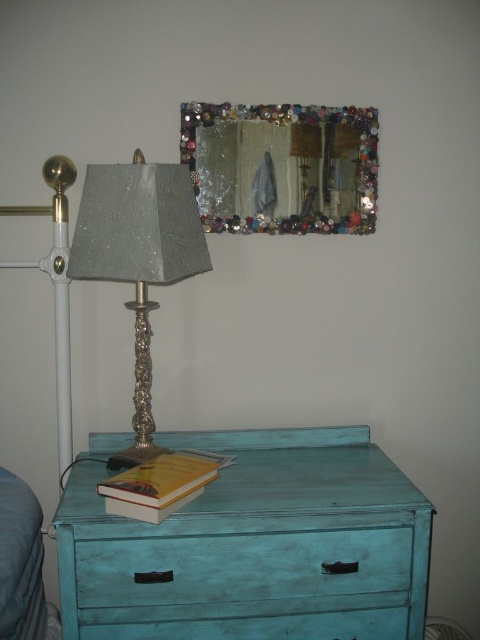
Question: Which object appears closest to the camera in this image?

Choices:
 (A) turquoise distressed wood table at lower center
 (B) yellow paperback book at lower center

Answer: (B)

Question: Is the position of decorative glass mirror at upper center more distant than that of shiny silver lamp at left?

Choices:
 (A) no
 (B) yes

Answer: (B)

Question: Which object is positioned closest to the decorative glass mirror at upper center?

Choices:
 (A) turquoise distressed wood table at lower center
 (B) shiny silver lamp at left
 (C) teal painted wood drawer at center
 (D) yellow paperback book at lower center

Answer: (B)

Question: Does decorative glass mirror at upper center appear on the right side of yellow paperback book at lower center?

Choices:
 (A) no
 (B) yes

Answer: (B)

Question: Which object is positioned farthest from the teal painted wood drawer at center?

Choices:
 (A) shiny silver lamp at left
 (B) decorative glass mirror at upper center
 (C) yellow paperback book at lower center
 (D) turquoise distressed wood table at lower center

Answer: (B)

Question: Can you confirm if decorative glass mirror at upper center is positioned above teal painted wood drawer at center?

Choices:
 (A) no
 (B) yes

Answer: (B)